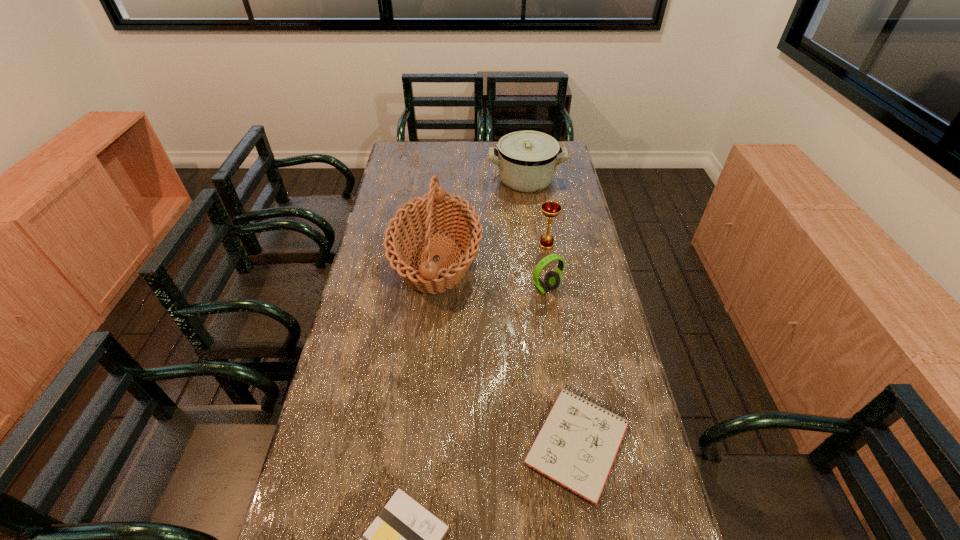
You are a GUI agent. You are given a task and a screenshot of the screen. Output one action in this format:
    pyautogui.click(x=<x>, y=<y>)
    Task: Click on the basket
    
    Given the screenshot: What is the action you would take?
    pyautogui.click(x=435, y=212)

Identify the location of saucepan. This screenshot has width=960, height=540. (527, 160).

Find the location of `chalice`. chalice is located at coordinates (550, 209).

I want to click on the fourth tallest object, so click(552, 279).

Find the location of a particular element. the fifth tallest object is located at coordinates (576, 446).

Where is `the right notepad`? the right notepad is located at coordinates (576, 446).

Locate an element on the screen. The width and height of the screenshot is (960, 540). free space located 0.110m on the right of the tallest object is located at coordinates (514, 261).

Identify the location of free point located 0.330m on the left of the saucepan. The width and height of the screenshot is (960, 540). (413, 179).

Locate an element on the screen. free region located 0.180m on the back of the chalice is located at coordinates [540, 209].

The height and width of the screenshot is (540, 960). Find the location of `vacant region located on the left of the fourth tallest object`. vacant region located on the left of the fourth tallest object is located at coordinates (515, 289).